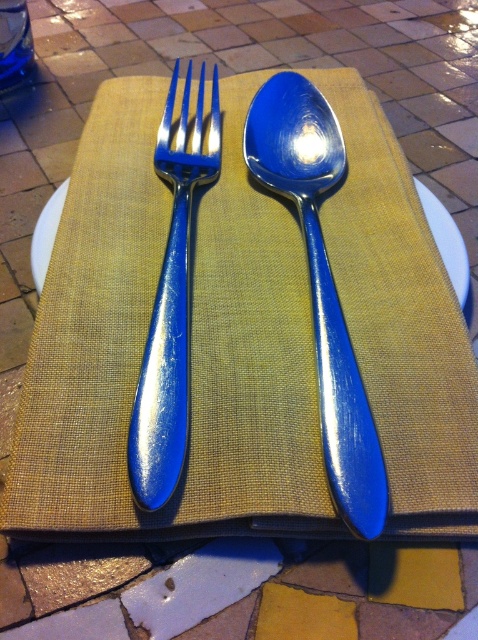
Question: Which point appears farthest from the camera in this image?

Choices:
 (A) (278, 77)
 (B) (162, 456)

Answer: (A)

Question: Is blue shiny spoon at center smaller than shiny blue fork at center?

Choices:
 (A) no
 (B) yes

Answer: (A)

Question: Can you confirm if blue shiny spoon at center is positioned to the right of shiny blue fork at center?

Choices:
 (A) no
 (B) yes

Answer: (B)

Question: Where is blue shiny spoon at center located in relation to shiny blue fork at center in the image?

Choices:
 (A) below
 (B) above

Answer: (A)

Question: Among these objects, which one is nearest to the camera?

Choices:
 (A) blue shiny spoon at center
 (B) shiny blue fork at center

Answer: (A)

Question: Which of the following is the farthest from the observer?

Choices:
 (A) shiny blue fork at center
 (B) blue shiny spoon at center

Answer: (A)